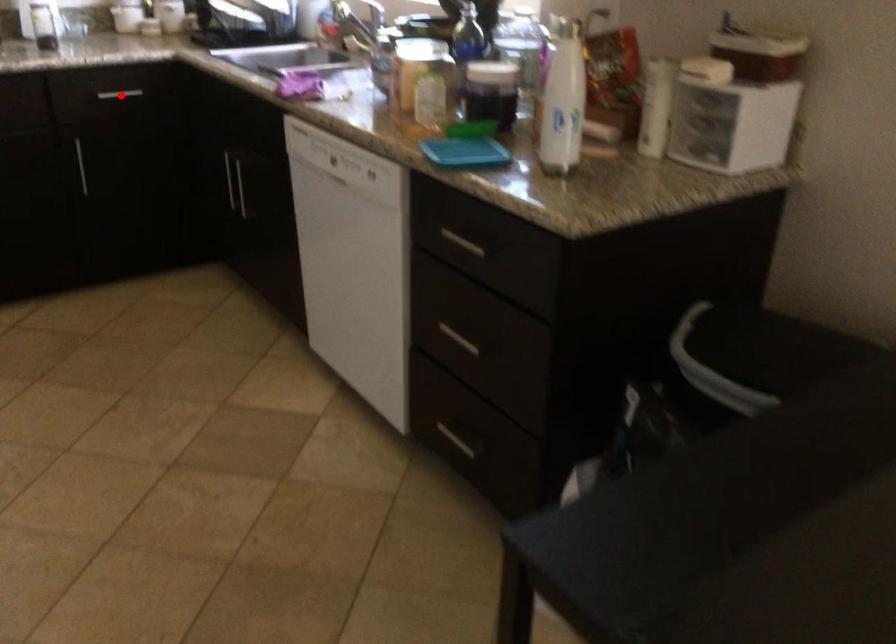
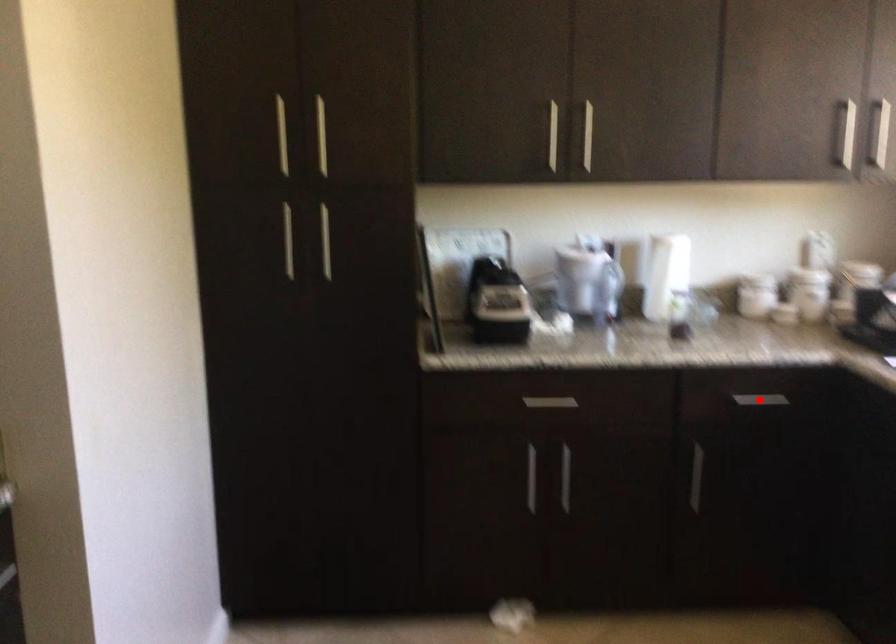
I am providing you with two images of the same scene from different viewpoints. A red point is marked on the first image and another point is marked on the second image. Does the point marked in image1 correspond to the same location as the one in image2?

Yes